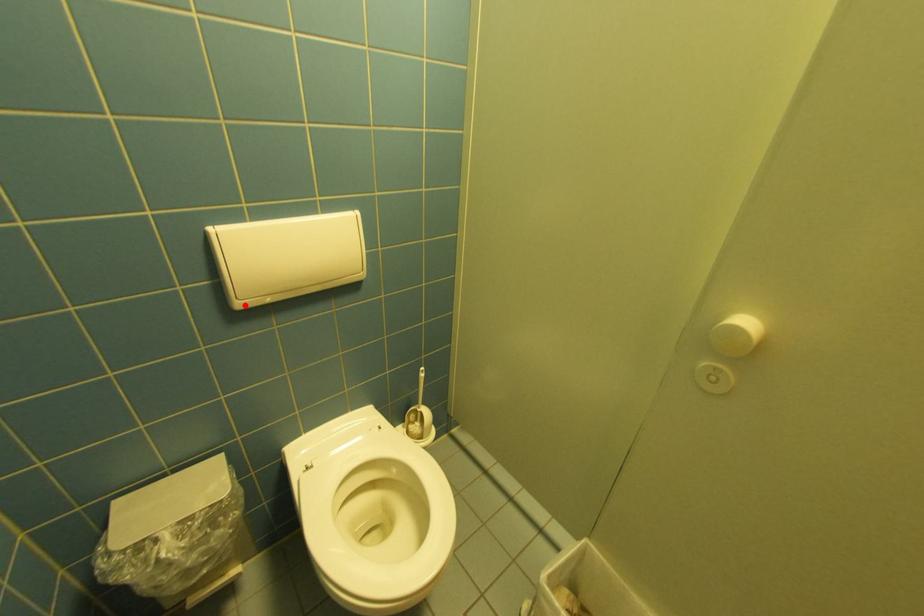
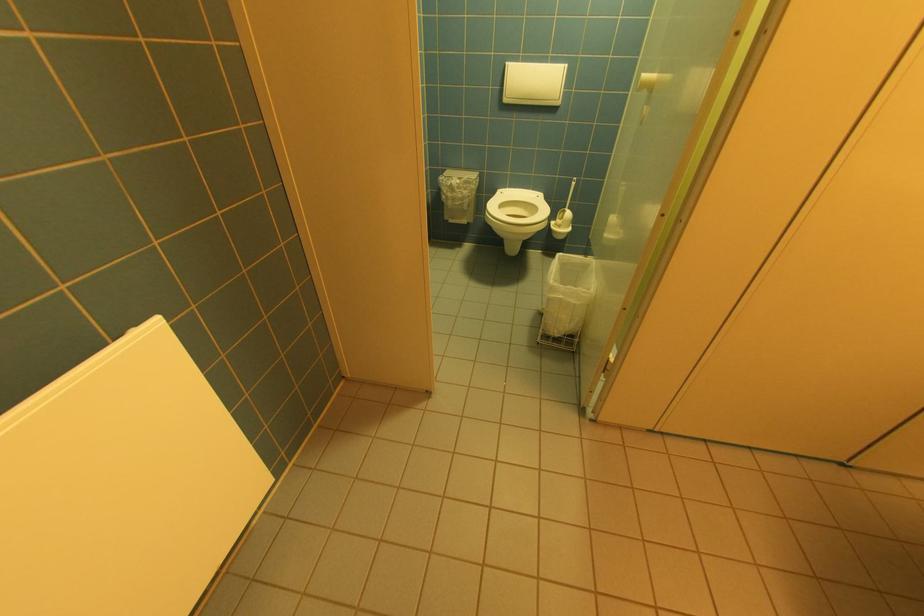
Where in the second image is the point corresponding to the highlighted location from the first image?

(512, 100)